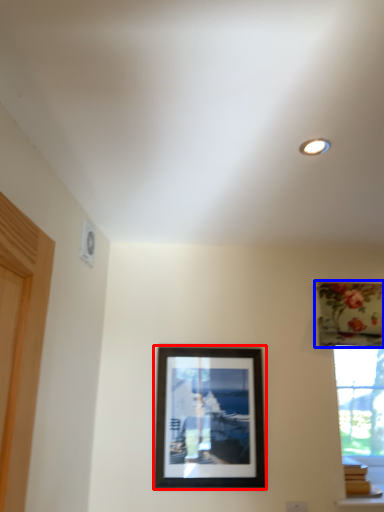
Question: Which object is closer to the camera taking this photo, picture frame (highlighted by a red box) or curtain (highlighted by a blue box)?

Choices:
 (A) picture frame
 (B) curtain

Answer: (A)